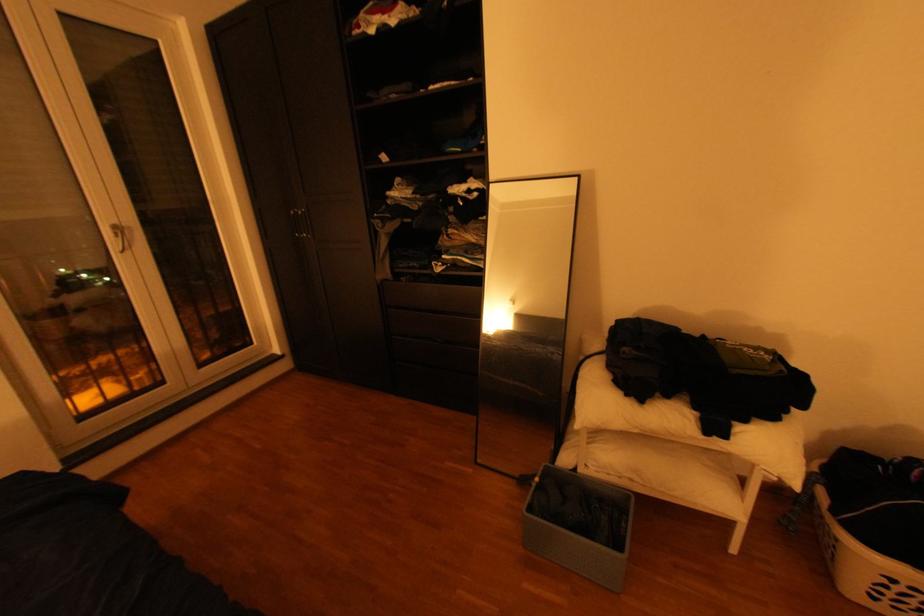
This screenshot has height=616, width=924. What are the coordinates of `grey storage bin` in the screenshot? It's located at (578, 525).